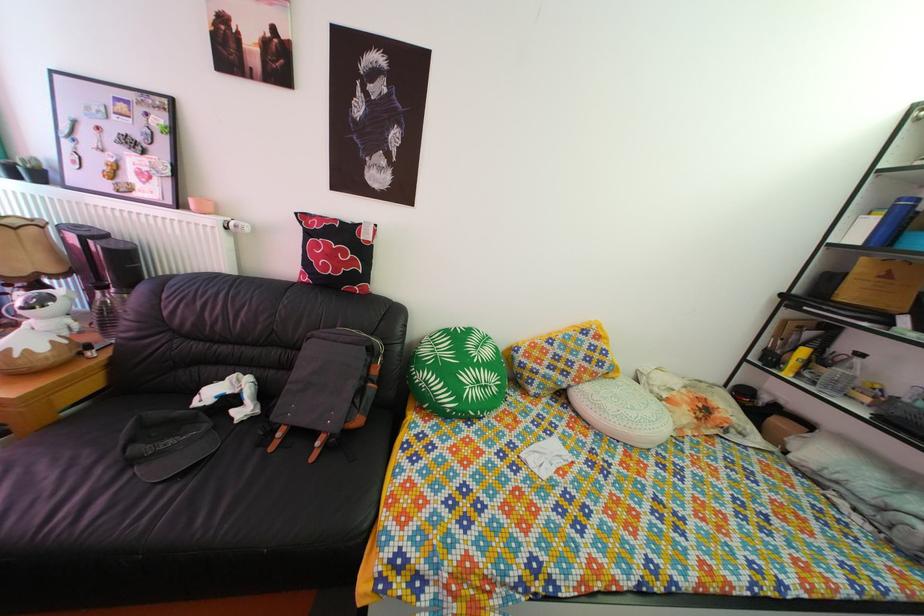
Describe the element at coordinates (237, 225) in the screenshot. The image size is (924, 616). I see `the white thermostat knob` at that location.